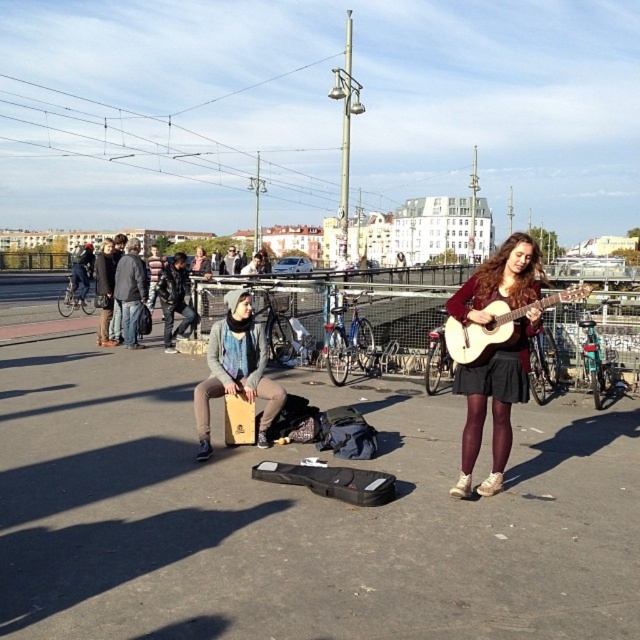
You are a photographer trying to capture both the acoustic wood guitar at right and the dark gray hoodie at center in a single shot. However, you notice that the guitar is partially blocking the view of the hoodie. How can you adjust your position to ensure both are fully visible?

Since the acoustic wood guitar at right is in front of the dark gray hoodie at center, you should move your position to the left side so that the guitar moves out of the way, allowing both objects to be fully visible in the frame.

You are a photographer trying to capture the musician playing the matte brown guitar at center. You notice the leather jacket at center is blocking part of the guitar. Based on their positions, can you adjust your angle to see the entire guitar without the jacket covering it?

The matte brown guitar at center is below the leather jacket at center, so if you position yourself lower or shift your angle downward, you can capture the entire guitar without the jacket blocking it.

You are a photographer standing at the center of the scene. You want to take a photo of the acoustic wood guitar at right and the leather jacket at center. Given that your camera has a maximum focus range of 10 meters, can you capture both objects clearly in the same photo without moving?

The acoustic wood guitar at right is 12.86 meters away from the leather jacket at center. Since the camera can only focus up to 10 meters, the distance between them exceeds the focus range. Therefore, you cannot capture both clearly in the same photo without moving.